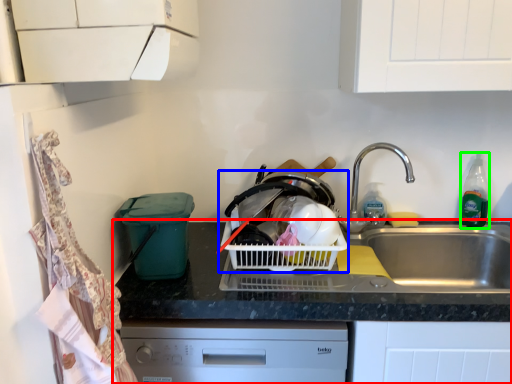
Question: Which object is the closest to the countertop (highlighted by a red box)? Choose among these: basket container (highlighted by a blue box) or bottle (highlighted by a green box).

Choices:
 (A) basket container
 (B) bottle

Answer: (A)